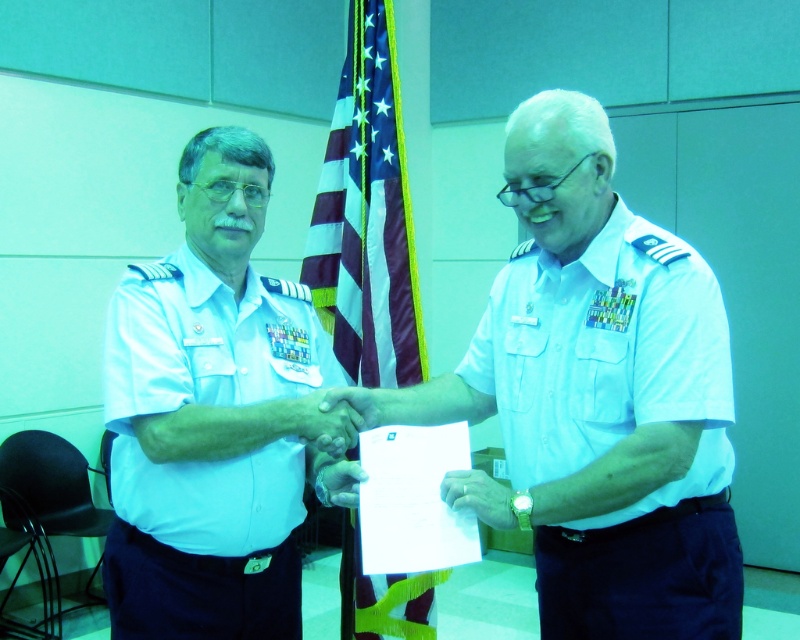
Does white cotton shirt at center have a lesser width compared to white matte hand at center?

No, white cotton shirt at center is not thinner than white matte hand at center.

Is point (690, 454) positioned in front of point (302, 426)?

Yes.

Identify the location of white cotton shirt at center. (618, 428).

Does white cotton shirt at center appear on the left side of white cotton shirt at left?

In fact, white cotton shirt at center is to the right of white cotton shirt at left.

Which is behind, point (530, 454) or point (237, 608)?

Point (237, 608)

The image size is (800, 640). I want to click on white cotton shirt at center, so click(x=618, y=428).

Is point (272, 317) closer to viewer compared to point (350, 435)?

No, (272, 317) is further to viewer.

Can you confirm if white cotton shirt at left is positioned to the right of white matte hand at center?

No, white cotton shirt at left is not to the right of white matte hand at center.

The image size is (800, 640). Find the location of `white cotton shirt at left`. white cotton shirt at left is located at coordinates (206, 460).